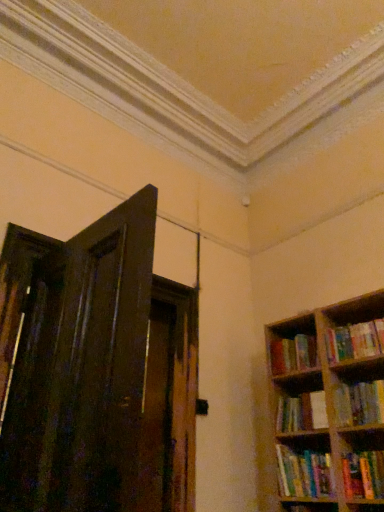
Question: From a real-world perspective, is hardcover books at right, the fifth book in the bottom-to-top sequence, physically located above or below hardcover book at right, placed as the third book when sorted from top to bottom?

Choices:
 (A) above
 (B) below

Answer: (A)

Question: Considering the positions of hardcover books at right, which is the 1th book from top to bottom, and hardcover book at right, placed as the third book when sorted from top to bottom, in the image, is hardcover books at right, which is the 1th book from top to bottom, taller or shorter than hardcover book at right, placed as the third book when sorted from top to bottom,?

Choices:
 (A) tall
 (B) short

Answer: (A)

Question: Which of these objects is positioned farthest from the multicolored paperbacks at right, the 4th book from the bottom?

Choices:
 (A) hardcover book at right, which is the fifth book from top to bottom
 (B) hardcover book at right, placed as the third book when sorted from top to bottom
 (C) hardcover books at right, the fifth book in the bottom-to-top sequence
 (D) hardcover book at right, arranged as the second book when ordered from the bottom
 (E) dark wood door at left

Answer: (E)

Question: Estimate the real-world distances between objects in this image. Which object is closer to the hardcover book at right, which is the fourth book in top-to-bottom order?

Choices:
 (A) dark wood door at left
 (B) multicolored paperbacks at right, acting as the 2th book starting from the top
 (C) hardcover books at right, the fifth book in the bottom-to-top sequence
 (D) hardcover book at right, marked as the third book in a bottom-to-top arrangement
 (E) hardcover book at right, which is the fifth book from top to bottom

Answer: (D)